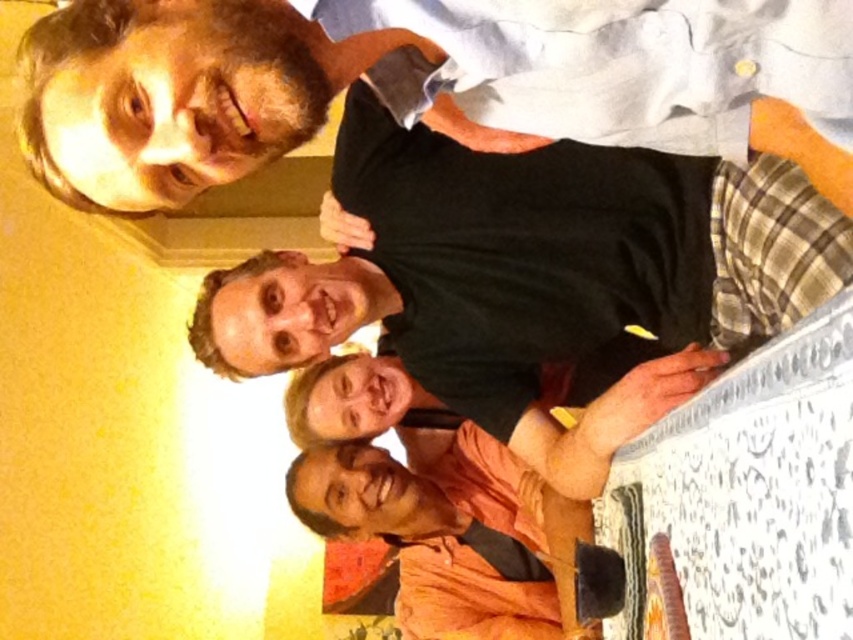
Between black matte shirt at upper center and matte black shirt at upper left, which one appears on the left side from the viewer's perspective?

matte black shirt at upper left

Describe the element at coordinates (523, 276) in the screenshot. Image resolution: width=853 pixels, height=640 pixels. I see `black matte shirt at upper center` at that location.

Who is more forward, (x=351, y=198) or (x=90, y=128)?

Positioned in front is point (x=90, y=128).

I want to click on black matte shirt at upper center, so click(523, 276).